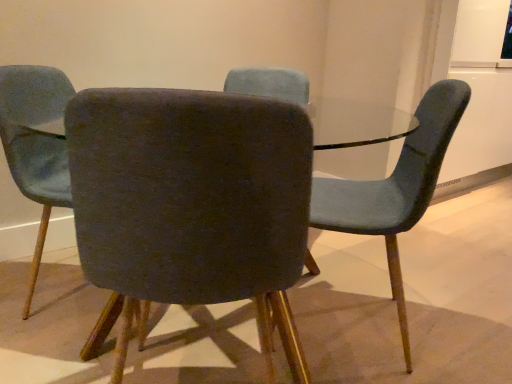
Where is `vacant area that lies to the right of velvet teal chair at right, the third chair from the left`? This screenshot has height=384, width=512. vacant area that lies to the right of velvet teal chair at right, the third chair from the left is located at coordinates (455, 329).